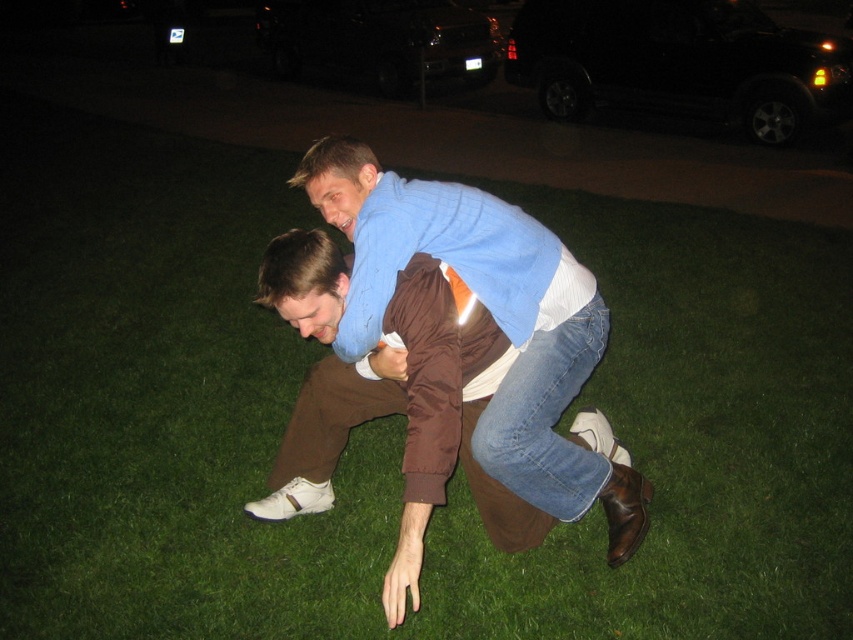
Question: Is blue cotton sweater at center positioned behind black matte suv at upper center?

Choices:
 (A) yes
 (B) no

Answer: (B)

Question: Can you confirm if blue cotton sweater at center is positioned above black matte suv at upper center?

Choices:
 (A) yes
 (B) no

Answer: (B)

Question: Which point appears closest to the camera in this image?

Choices:
 (A) (642, 61)
 (B) (479, 456)

Answer: (B)

Question: Among these points, which one is nearest to the camera?

Choices:
 (A) (827, 115)
 (B) (404, 221)

Answer: (B)

Question: Does blue cotton sweater at center appear under black matte suv at upper center?

Choices:
 (A) no
 (B) yes

Answer: (B)